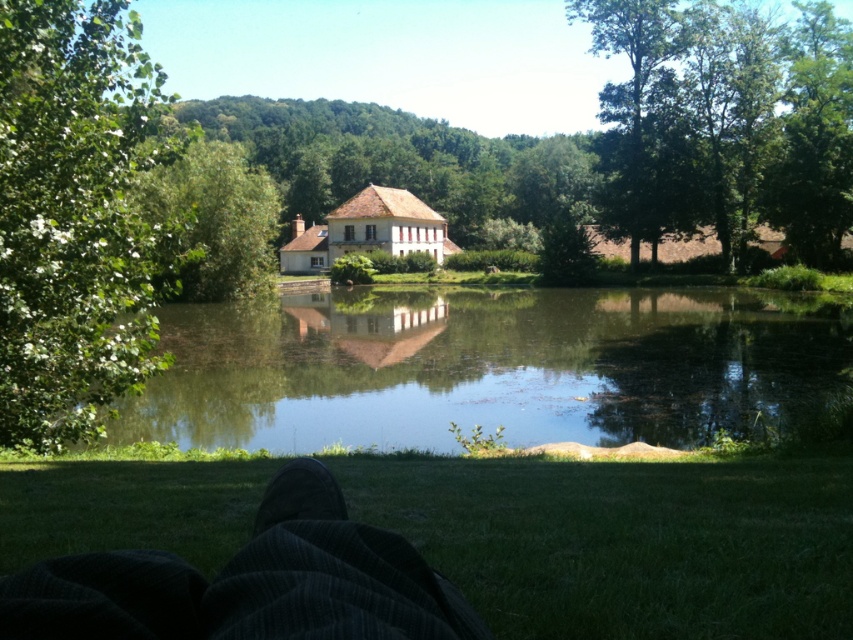
You are standing at the edge of the pond and want to take a photo of both the green leafy tree at left and the green leafy tree at upper right. Which tree should you position yourself closer to in order to capture both in the frame?

Since the green leafy tree at left is located below the green leafy tree at upper right, you should position yourself closer to the green leafy tree at left to ensure both trees are within the camera frame.